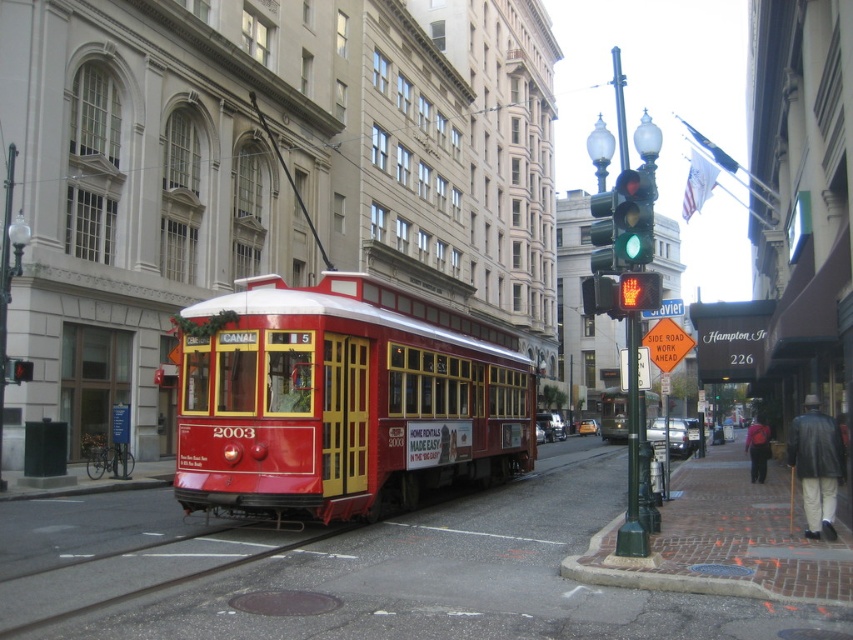
Is green glass traffic light at upper center further to the viewer compared to red glass pedestrian signal at center?

Yes, green glass traffic light at upper center is further from the viewer.

The width and height of the screenshot is (853, 640). Describe the element at coordinates (633, 216) in the screenshot. I see `green glass traffic light at upper center` at that location.

Does point (619, 244) lie behind point (659, 307)?

That is True.

You are a GUI agent. You are given a task and a screenshot of the screen. Output one action in this format:
    pyautogui.click(x=<x>, y=<y>)
    Task: Click on the green glass traffic light at upper center
    The width and height of the screenshot is (853, 640).
    Given the screenshot: What is the action you would take?
    pyautogui.click(x=633, y=216)